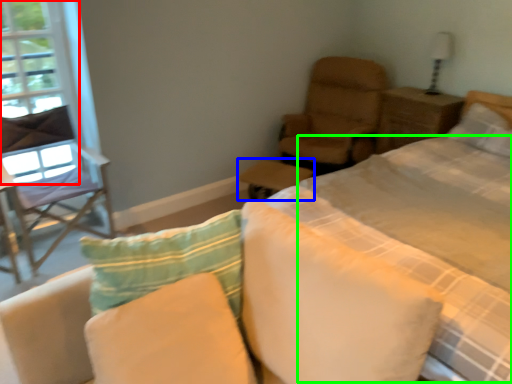
Question: Which is nearer to the window screen (highlighted by a red box)? table (highlighted by a blue box) or quilt (highlighted by a green box).

Choices:
 (A) table
 (B) quilt

Answer: (A)